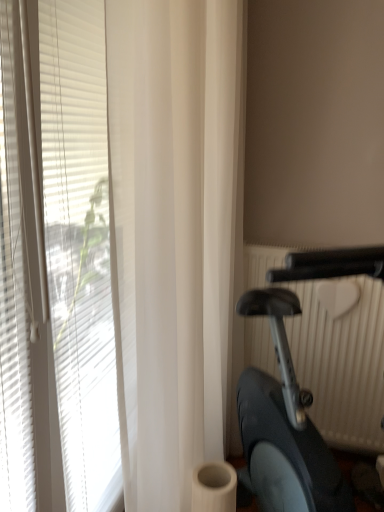
What is the approximate width of white matte blinds at left?

The width of white matte blinds at left is 7.75 inches.

What are the coordinates of `white matte blinds at left` in the screenshot? It's located at (143, 238).

What do you see at coordinates (143, 238) in the screenshot?
I see `white matte blinds at left` at bounding box center [143, 238].

This screenshot has width=384, height=512. Describe the element at coordinates (302, 394) in the screenshot. I see `metallic silver stationary bicycle at right` at that location.

Find the location of a particular element. This screenshot has height=512, width=384. metallic silver stationary bicycle at right is located at coordinates (302, 394).

What are the coordinates of `white matte blinds at left` in the screenshot? It's located at (143, 238).

Considering the relative positions of white matte blinds at left and metallic silver stationary bicycle at right in the image provided, is white matte blinds at left to the right of metallic silver stationary bicycle at right from the viewer's perspective?

No, white matte blinds at left is not to the right of metallic silver stationary bicycle at right.

Considering the relative positions of white matte blinds at left and metallic silver stationary bicycle at right in the image provided, is white matte blinds at left behind metallic silver stationary bicycle at right?

Yes.

Which is further, (234,270) or (294,335)?

The point (294,335) is farther from the camera.

From the image's perspective, does white matte blinds at left appear lower than metallic silver stationary bicycle at right?

No, from the image's perspective, white matte blinds at left is not below metallic silver stationary bicycle at right.

From a real-world perspective, is white matte blinds at left on metallic silver stationary bicycle at right?

Yes.

In terms of width, does white matte blinds at left look wider or thinner when compared to metallic silver stationary bicycle at right?

Considering their sizes, white matte blinds at left looks slimmer than metallic silver stationary bicycle at right.

Between white matte blinds at left and metallic silver stationary bicycle at right, which one has more height?

white matte blinds at left is taller.

Looking at the image, does white matte blinds at left seem bigger or smaller compared to metallic silver stationary bicycle at right?

Considering their sizes, white matte blinds at left takes up less space than metallic silver stationary bicycle at right.

Is white matte blinds at left outside of metallic silver stationary bicycle at right?

Absolutely, white matte blinds at left is external to metallic silver stationary bicycle at right.

Are white matte blinds at left and metallic silver stationary bicycle at right located far from each other?

No, there isn't a large distance between white matte blinds at left and metallic silver stationary bicycle at right.

Is white matte blinds at left facing away from metallic silver stationary bicycle at right?

Yes.

Where is `stationary bicycle that is on the right side of white matte blinds at left`? stationary bicycle that is on the right side of white matte blinds at left is located at coordinates (302, 394).

Which is more to the right, metallic silver stationary bicycle at right or white matte blinds at left?

From the viewer's perspective, metallic silver stationary bicycle at right appears more on the right side.

Does metallic silver stationary bicycle at right lie in front of white matte blinds at left?

Yes, metallic silver stationary bicycle at right is closer to the viewer.

From the picture: Which is closer to the camera, (x=270, y=504) or (x=26, y=445)?

Point (x=270, y=504) is positioned farther from the camera compared to point (x=26, y=445).

From the image's perspective, which one is positioned higher, metallic silver stationary bicycle at right or white matte blinds at left?

From the image's view, white matte blinds at left is above.

From a real-world perspective, is metallic silver stationary bicycle at right under white matte blinds at left?

Yes.

Consider the image. Between metallic silver stationary bicycle at right and white matte blinds at left, which one has smaller width?

white matte blinds at left.

Between metallic silver stationary bicycle at right and white matte blinds at left, which one has more height?

white matte blinds at left.

Who is smaller, metallic silver stationary bicycle at right or white matte blinds at left?

Result: With smaller size is white matte blinds at left.

Would you say metallic silver stationary bicycle at right is inside or outside white matte blinds at left?

metallic silver stationary bicycle at right is located beyond the bounds of white matte blinds at left.

Is metallic silver stationary bicycle at right not close to white matte blinds at left?

No, metallic silver stationary bicycle at right is in close proximity to white matte blinds at left.

From the picture: Is white matte blinds at left at the back of metallic silver stationary bicycle at right?

Yes, metallic silver stationary bicycle at right is facing away from white matte blinds at left.

How different are the orientations of metallic silver stationary bicycle at right and white matte blinds at left in degrees?

There is a 49.3-degree angle between the facing directions of metallic silver stationary bicycle at right and white matte blinds at left.

Image resolution: width=384 pixels, height=512 pixels. In order to click on stationary bicycle below the white matte blinds at left (from the image's perspective) in this screenshot , I will do `click(302, 394)`.

This screenshot has height=512, width=384. In order to click on stationary bicycle below the white matte blinds at left (from a real-world perspective) in this screenshot , I will do `click(302, 394)`.

Locate an element on the screen. stationary bicycle that appears below the white matte blinds at left (from the image's perspective) is located at coordinates (302, 394).